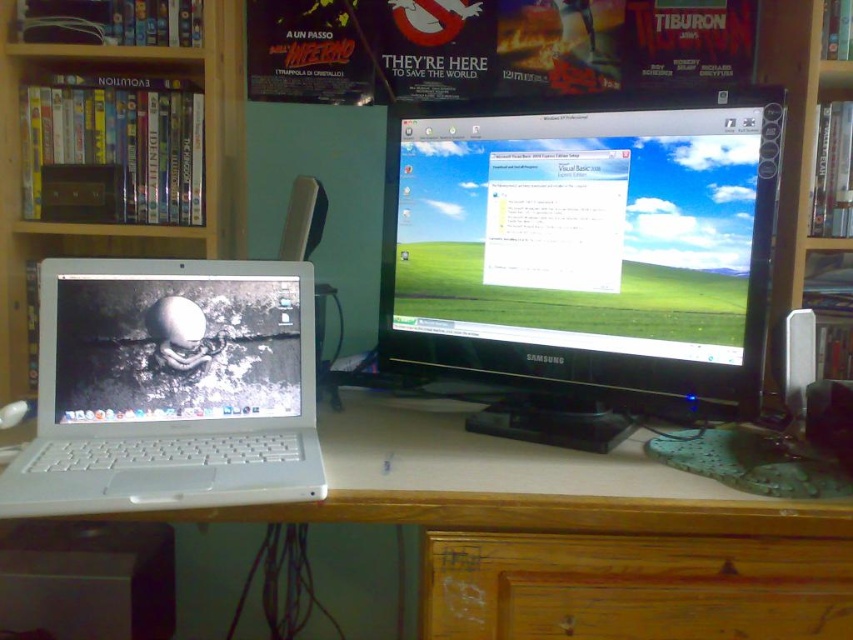
Does black glossy monitor at center appear under white glossy laptop at left?

Incorrect, black glossy monitor at center is not positioned below white glossy laptop at left.

Does black glossy monitor at center have a greater width compared to white glossy laptop at left?

Indeed, black glossy monitor at center has a greater width compared to white glossy laptop at left.

Locate an element on the screen. This screenshot has width=853, height=640. black glossy monitor at center is located at coordinates (583, 257).

Who is more forward, (165, 312) or (459, 515)?

Point (459, 515)

From the picture: Who is positioned more to the right, white plastic laptop at left or white wood computer desk at center?

→ white wood computer desk at center is more to the right.

Between point (302, 333) and point (503, 630), which one is positioned in front?

Point (503, 630) is more forward.

At what (x,y) coordinates should I click in order to perform the action: click on white plastic laptop at left. Please return your answer as a coordinate pair (x, y). Looking at the image, I should click on (170, 387).

Is white glossy laptop at left in front of wooden bookcase at right?

No, it is behind wooden bookcase at right.

Locate an element on the screen. white glossy laptop at left is located at coordinates (183, 342).